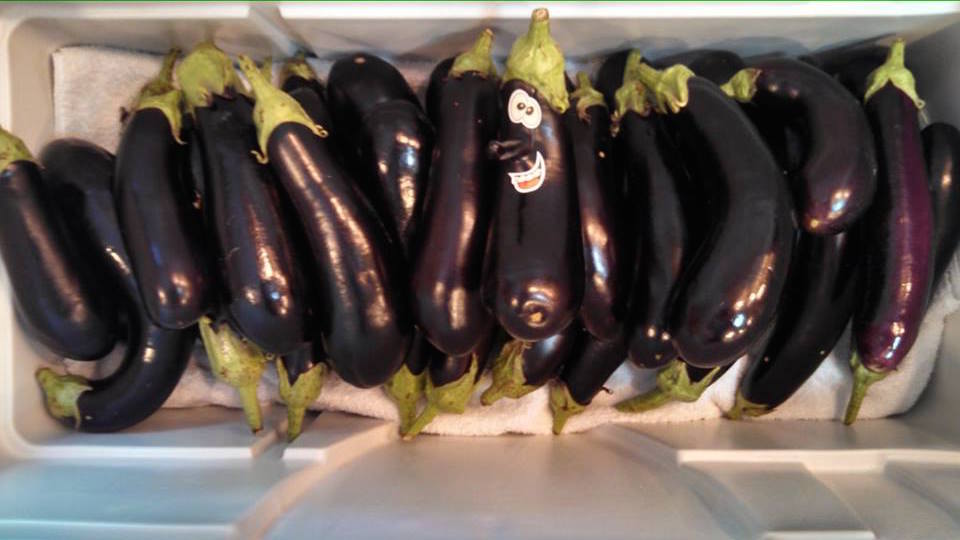
You are a GUI agent. You are given a task and a screenshot of the screen. Output one action in this format:
    pyautogui.click(x=<x>, y=<y>)
    Task: Click on the gaps between towel and container
    The height and width of the screenshot is (540, 960).
    Given the screenshot: What is the action you would take?
    pyautogui.click(x=352, y=415), pyautogui.click(x=899, y=415), pyautogui.click(x=145, y=52)